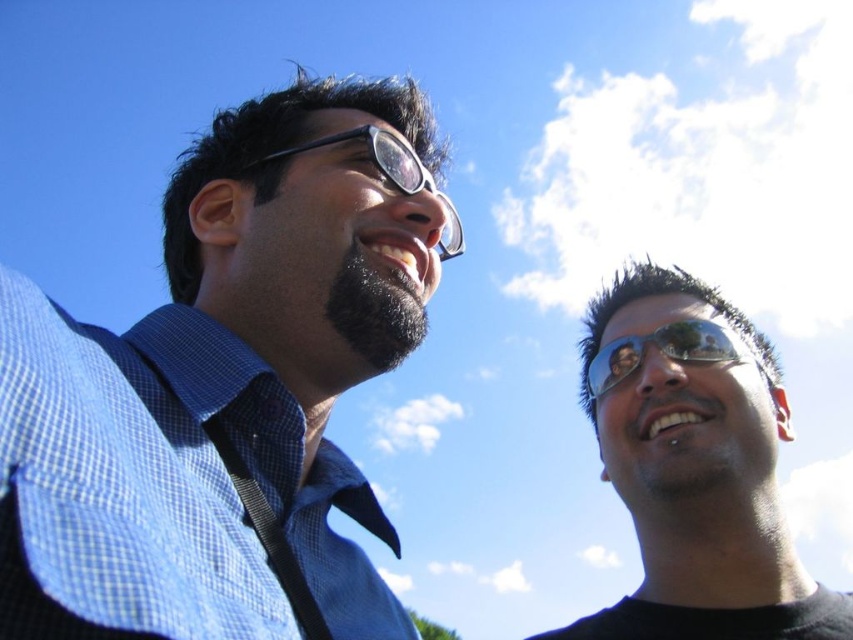
Does sunglasses at center have a larger size compared to sunglasses at right?

Yes.

Who is taller, sunglasses at center or sunglasses at right?

sunglasses at center

Does point (682, 362) lie in front of point (630, 360)?

Yes, it is.

Identify the location of sunglasses at center. (697, 477).

Is sunglasses at center bigger than black plastic goggles at upper center?

Indeed, sunglasses at center has a larger size compared to black plastic goggles at upper center.

Is sunglasses at center below black plastic goggles at upper center?

Correct, sunglasses at center is located below black plastic goggles at upper center.

Is point (801, 577) farther from camera compared to point (402, 154)?

Yes, it is behind point (402, 154).

Identify the location of sunglasses at center. pyautogui.click(x=697, y=477).

Does blue checkered shirt at left have a lesser width compared to sunglasses at right?

No.

Measure the distance between point (305, 474) and camera.

13.77 meters

Where is `blue checkered shirt at left`? Image resolution: width=853 pixels, height=640 pixels. blue checkered shirt at left is located at coordinates (225, 384).